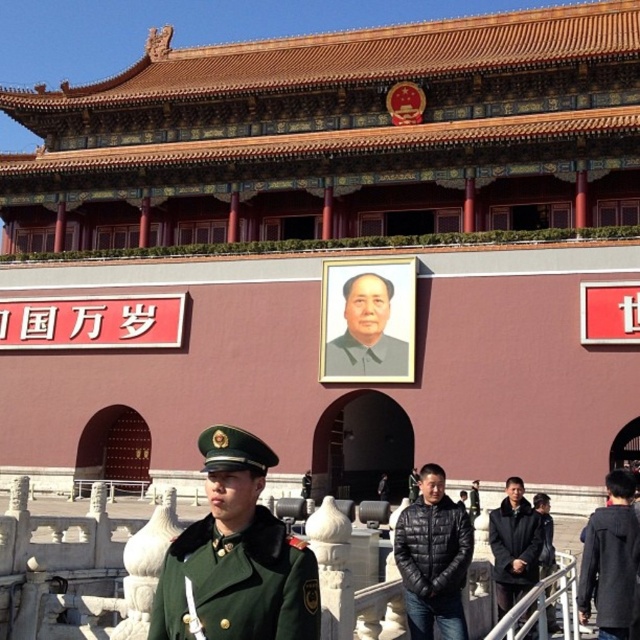
Can you confirm if smooth gray portrait at center is positioned above green fabric uniform at center?

Yes.

Which is above, smooth gray portrait at center or green fabric uniform at center?

smooth gray portrait at center is higher up.

Where is `smooth gray portrait at center`? smooth gray portrait at center is located at coordinates (365, 332).

Between green woolen uniform at center and green fabric uniform at center, which one appears on the left side from the viewer's perspective?

Positioned to the left is green fabric uniform at center.

What do you see at coordinates (433, 564) in the screenshot? I see `green woolen uniform at center` at bounding box center [433, 564].

The width and height of the screenshot is (640, 640). I want to click on green woolen uniform at center, so click(433, 564).

Consider the image. Can you confirm if green woolen uniform at center is smaller than smooth gray portrait at center?

Yes, green woolen uniform at center is smaller than smooth gray portrait at center.

Is point (436, 595) farther from viewer compared to point (355, 308)?

No, (436, 595) is in front of (355, 308).

Is point (458, 592) positioned in front of point (385, 353)?

Yes.

Identify the location of green woolen uniform at center. This screenshot has height=640, width=640. (433, 564).